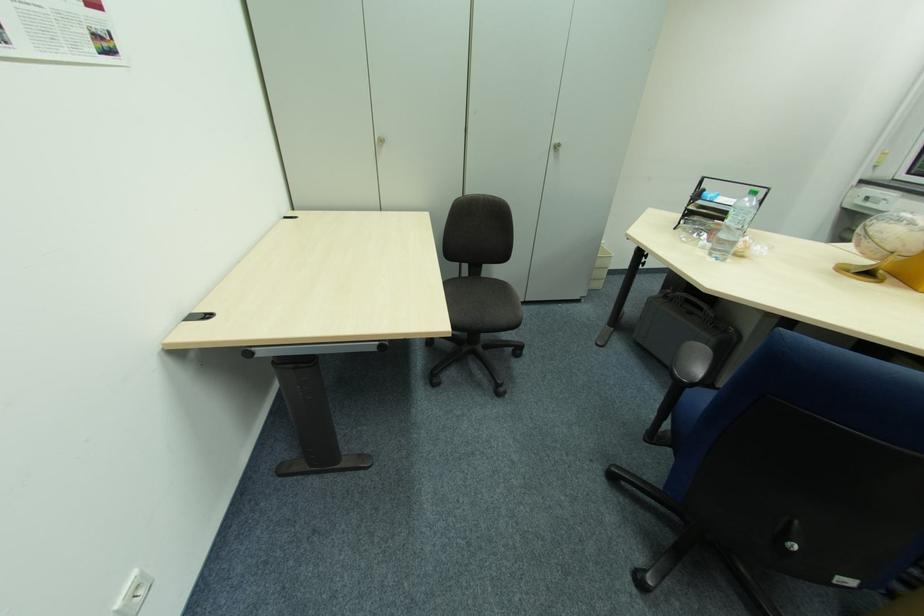
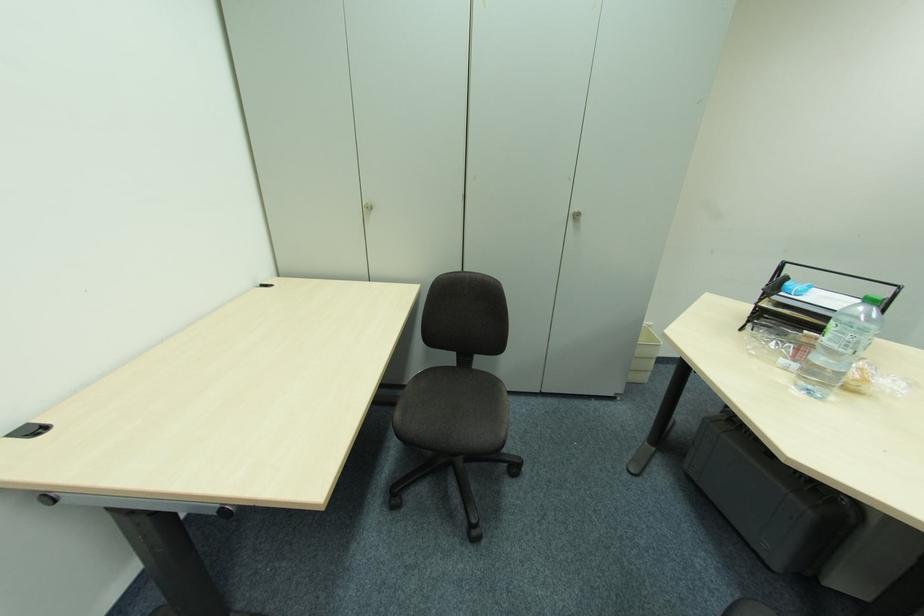
Question: The images are taken continuously from a first-person perspective. In which direction is your viewpoint rotating?

Choices:
 (A) Left
 (B) Right
 (C) Up
 (D) Down

Answer: (A)